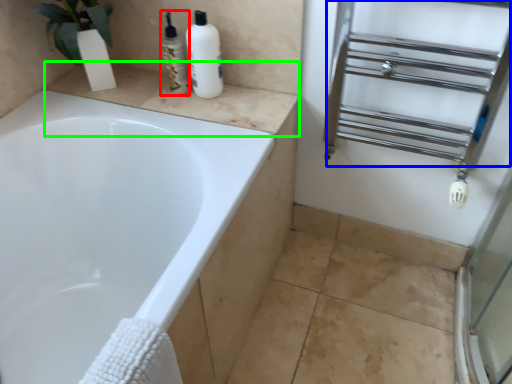
Question: Which is nearer to the toiletry (highlighted by a red box)? shelf (highlighted by a blue box) or counter top (highlighted by a green box).

Choices:
 (A) shelf
 (B) counter top

Answer: (B)